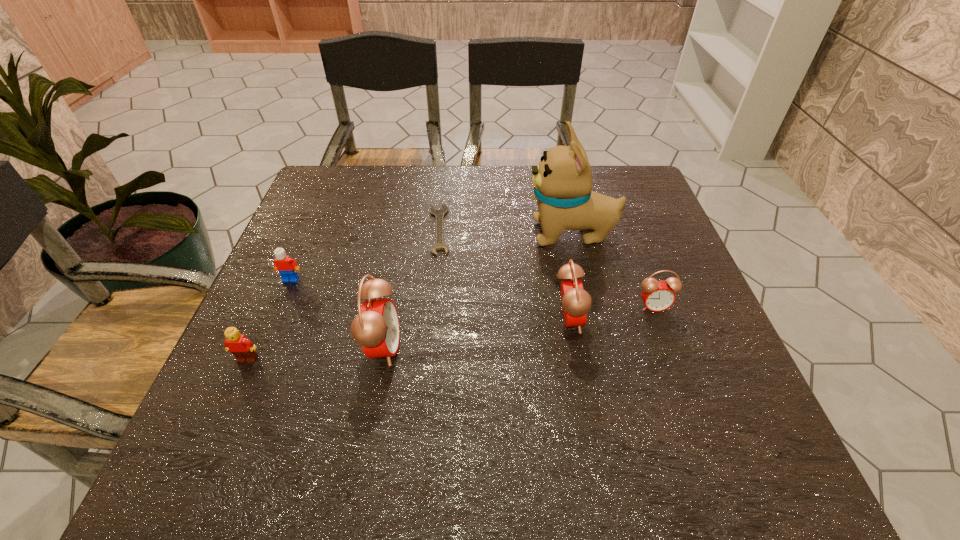
Please determine a free point for an extra alarm_clock to ensure balance. Please provide its 2D coordinates. Your answer should be formatted as a tuple, i.e. [(x, y)], where the tuple contains the x and y coordinates of a point satisfying the conditions above.

[(478, 332)]